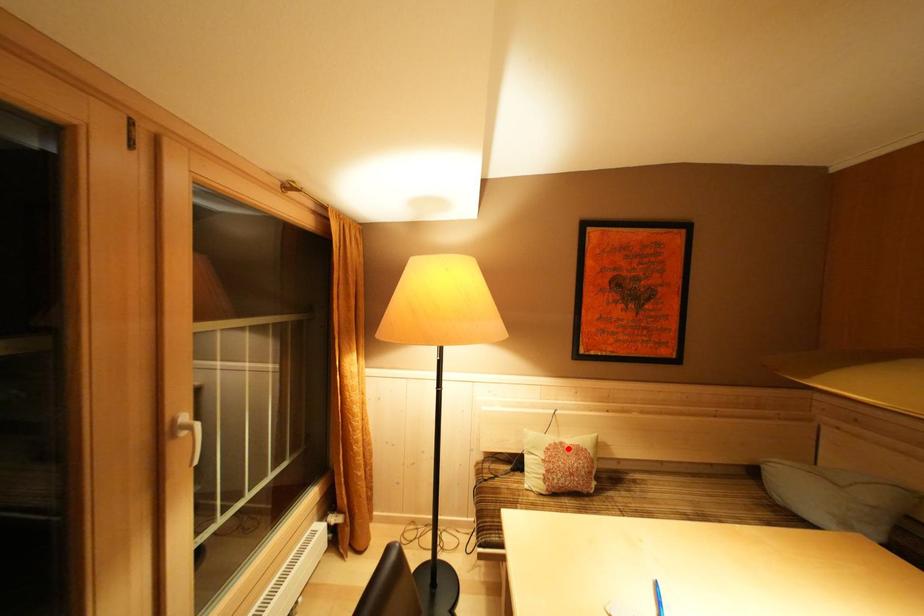
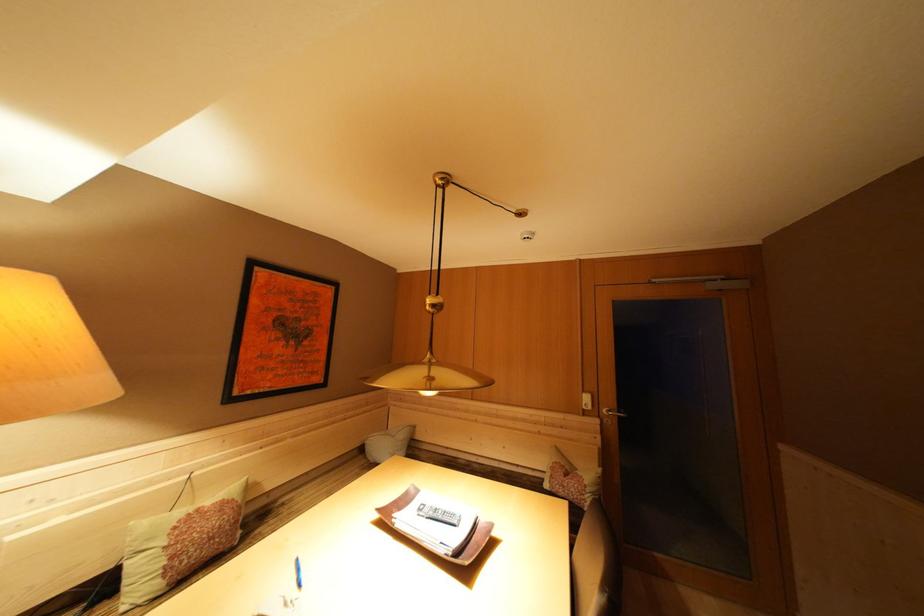
Question: A red point is marked in image1. In image2, is the corresponding 3D point closer to the camera or farther? Reply with the corresponding letter.

Choices:
 (A) The corresponding 3D point is closer.
 (B) The corresponding 3D point is farther.

Answer: (A)